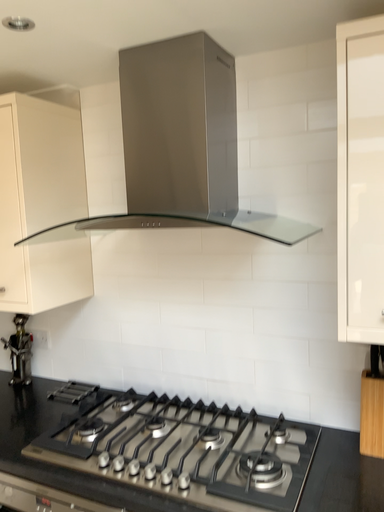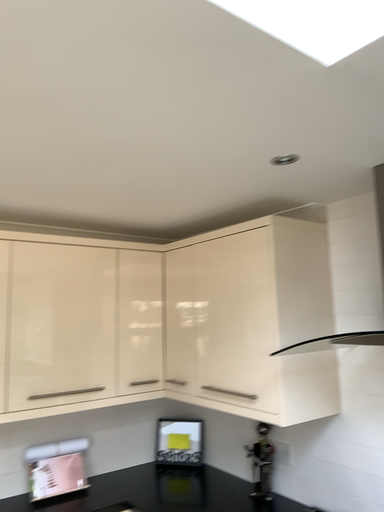
Question: Which way did the camera rotate in the video?

Choices:
 (A) rotated downward
 (B) rotated upward

Answer: (B)